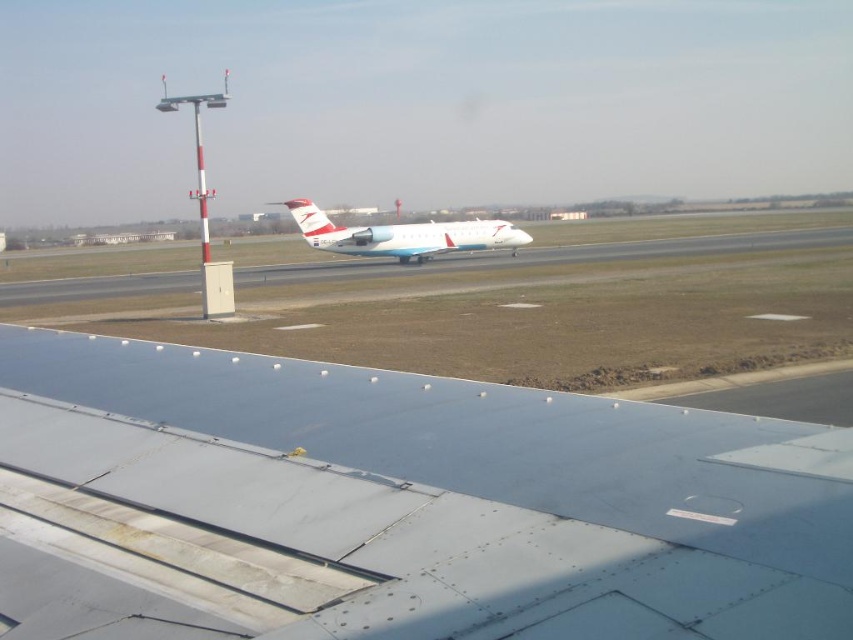
Who is taller, metallic gray wing at lower center or white glossy airplane at center?

Standing taller between the two is white glossy airplane at center.

Is metallic gray wing at lower center smaller than white glossy airplane at center?

Yes, metallic gray wing at lower center is smaller than white glossy airplane at center.

Find the location of a particular element. This screenshot has height=640, width=853. metallic gray wing at lower center is located at coordinates [x=398, y=506].

The image size is (853, 640). I want to click on metallic gray wing at lower center, so click(398, 506).